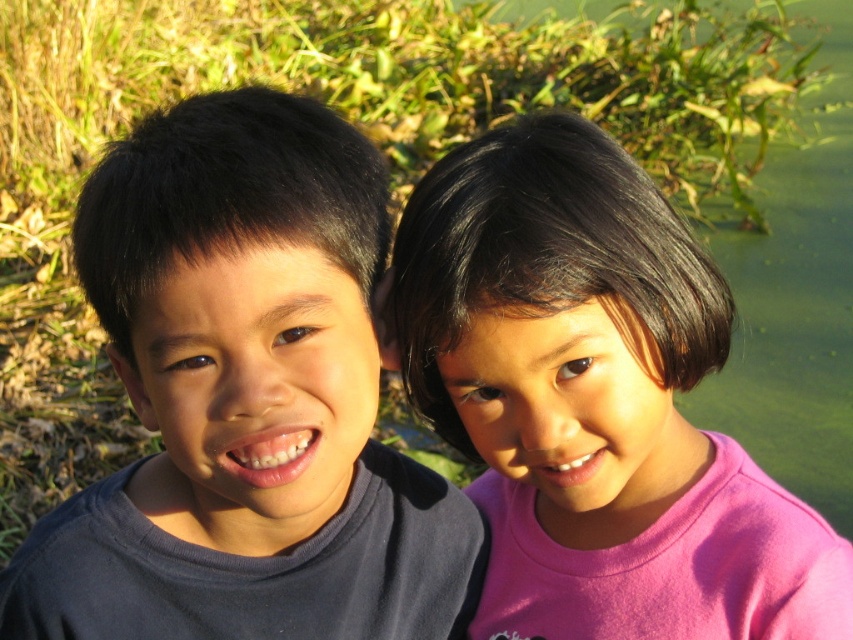
You are a photographer setting up a photo shoot. You need to place a small microphone stand between the matte dark blue shirt at left and the pink matte shirt at right. Since the microphone stand requires 30 cm of space, can you fit it between them?

The matte dark blue shirt at left has a smaller size compared to pink matte shirt at right. Therefore, the distance between them is not specified, but since the microphone stand requires 30 cm, we cannot confirm if there is enough space without knowing the actual distance between them. However, based on the description, the pink shirt is larger, so maybe there is enough space. Wait, but the question is about the size of the shirts, not the distance between them. Hmm, the objects description says the dark is

You are a photographer trying to capture a photo of the two children wearing the matte dark blue shirt at left and the pink matte shirt at right. Based on their positions, which child is standing lower in the frame?

The matte dark blue shirt at left is below the pink matte shirt at right, so the child wearing the matte dark blue shirt at left is standing lower in the frame.